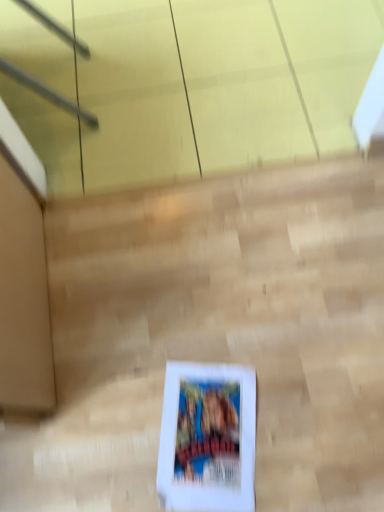
Image resolution: width=384 pixels, height=512 pixels. I want to click on unoccupied region to the right of white paper at center, so click(307, 416).